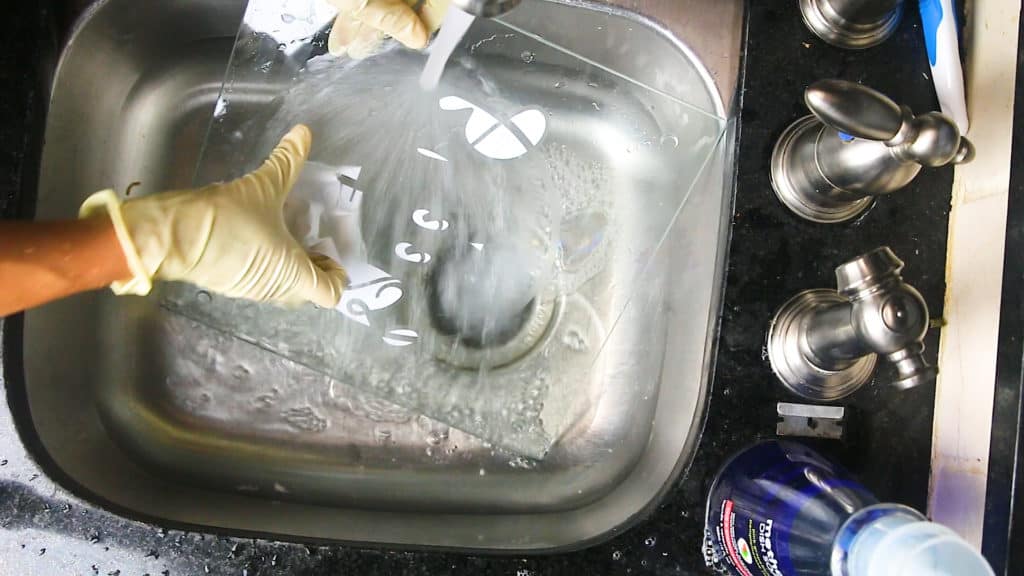
Locate an element on the screen. counter is located at coordinates 738,279.